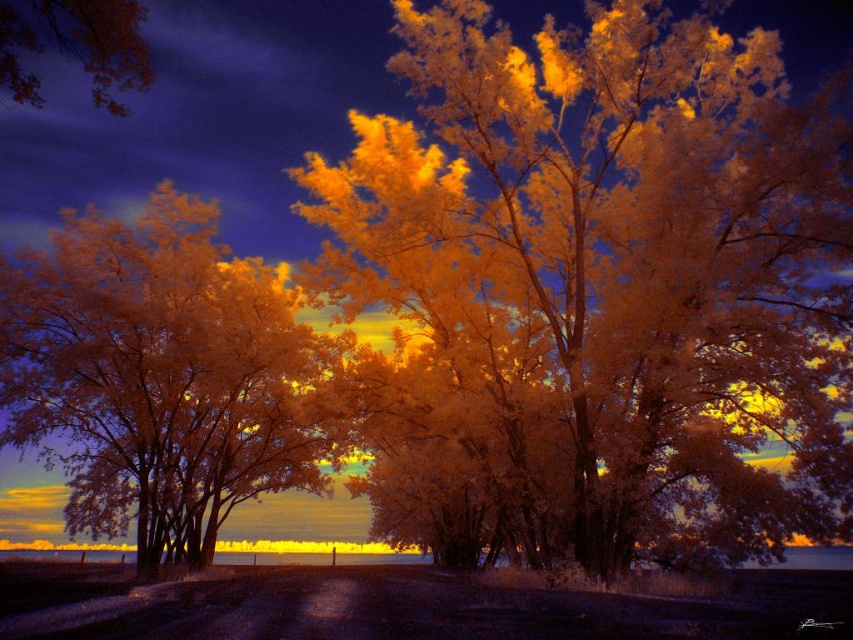
Is golden textured tree at center to the left of orange leafy tree at upper left from the viewer's perspective?

No, golden textured tree at center is not to the left of orange leafy tree at upper left.

Is golden textured tree at center wider than orange leafy tree at upper left?

Indeed, golden textured tree at center has a greater width compared to orange leafy tree at upper left.

The width and height of the screenshot is (853, 640). What do you see at coordinates (608, 282) in the screenshot? I see `golden textured tree at center` at bounding box center [608, 282].

This screenshot has width=853, height=640. Find the location of `golden textured tree at center`. golden textured tree at center is located at coordinates (608, 282).

Which of these two, golden textured tree at center or golden translucent tree at center, stands shorter?

golden translucent tree at center is shorter.

Who is more distant from viewer, (369, 241) or (207, 216)?

Positioned behind is point (207, 216).

Does point (668, 531) come behind point (207, 413)?

No.

Image resolution: width=853 pixels, height=640 pixels. Find the location of `golden textured tree at center`. golden textured tree at center is located at coordinates (608, 282).

Can you confirm if golden translucent tree at center is positioned above orange leafy tree at upper left?

Incorrect, golden translucent tree at center is not positioned above orange leafy tree at upper left.

Is the position of golden translucent tree at center more distant than that of orange leafy tree at upper left?

Yes, it is.

Is point (141, 554) less distant than point (126, 45)?

That is False.

I want to click on golden translucent tree at center, so click(x=160, y=378).